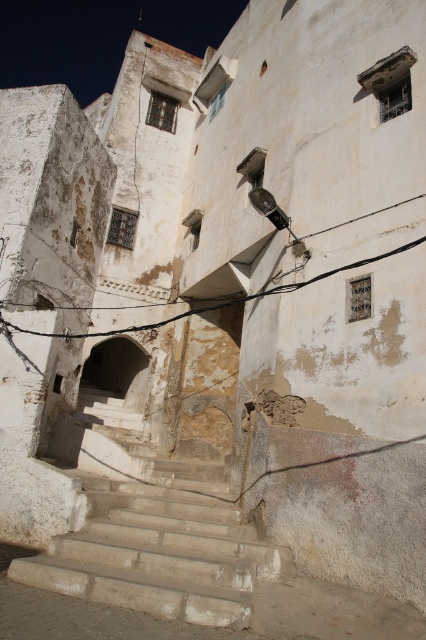
Question: Which of the following is the closest to the observer?

Choices:
 (A) black wire at upper center
 (B) smooth concrete stairs at center

Answer: (B)

Question: Which object is closer to the camera taking this photo?

Choices:
 (A) smooth concrete stairs at center
 (B) black wire at upper center

Answer: (A)

Question: Observing the image, what is the correct spatial positioning of smooth concrete stairs at center in reference to black wire at upper center?

Choices:
 (A) right
 (B) left

Answer: (B)

Question: Is smooth concrete stairs at center to the left of black wire at upper center from the viewer's perspective?

Choices:
 (A) no
 (B) yes

Answer: (B)

Question: Is smooth concrete stairs at center positioned in front of black wire at upper center?

Choices:
 (A) yes
 (B) no

Answer: (A)